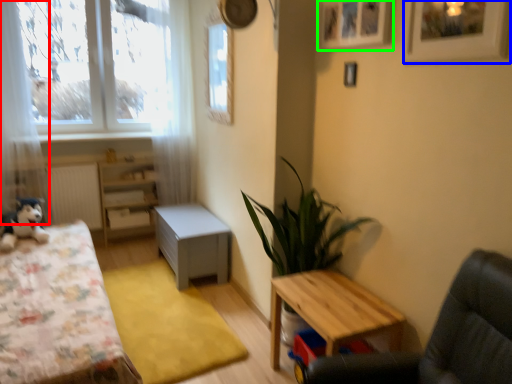
Question: Which is nearer to the curtain (highlighted by a red box)? picture frame (highlighted by a blue box) or picture frame (highlighted by a green box).

Choices:
 (A) picture frame
 (B) picture frame

Answer: (B)